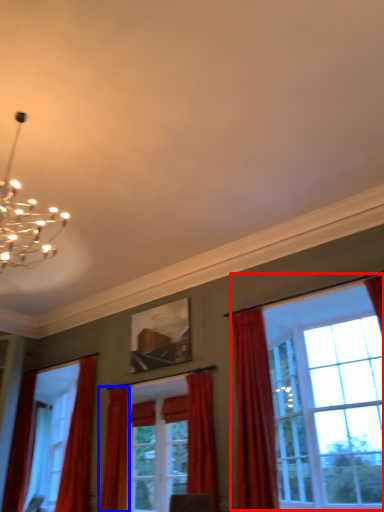
Question: Which of the following is the closest to the observer, window (highlighted by a red box) or curtain (highlighted by a blue box)?

Choices:
 (A) window
 (B) curtain

Answer: (A)